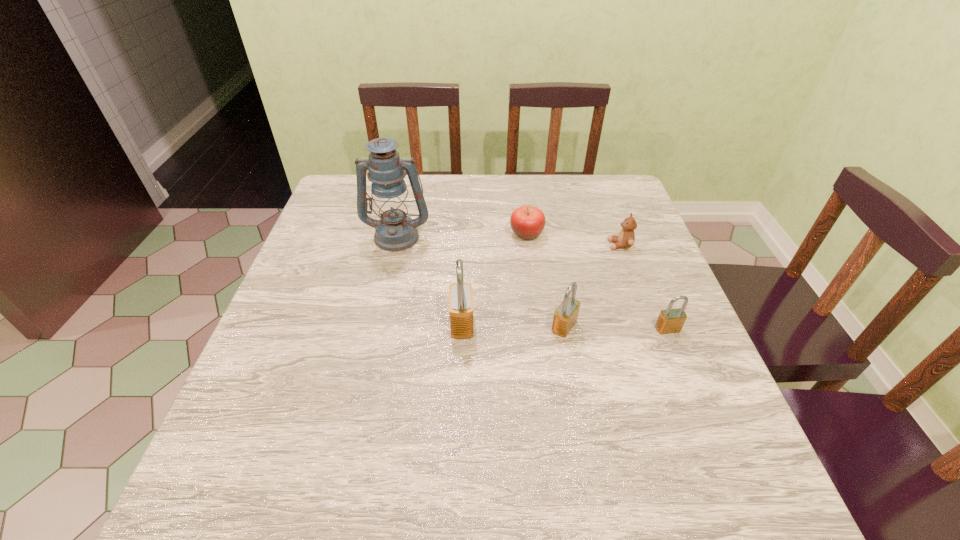
Find the location of a particular element. The height and width of the screenshot is (540, 960). the leftmost padlock is located at coordinates (460, 294).

Where is `the second tallest object`? the second tallest object is located at coordinates (460, 294).

The width and height of the screenshot is (960, 540). I want to click on the second padlock from left to right, so click(x=565, y=316).

Where is `the fourth shortest object`? The height and width of the screenshot is (540, 960). the fourth shortest object is located at coordinates (565, 316).

I want to click on the shortest padlock, so click(671, 320).

At what (x,y) coordinates should I click in order to perform the action: click on teddy bear. Please return your answer as a coordinate pair (x, y). This screenshot has height=540, width=960. Looking at the image, I should click on (626, 237).

Where is `the leftmost object`? the leftmost object is located at coordinates (395, 231).

Identify the location of lantern. The image size is (960, 540). (395, 231).

Locate an element on the screen. The height and width of the screenshot is (540, 960). apple is located at coordinates (527, 222).

This screenshot has width=960, height=540. I want to click on free location located on the left of the tallest padlock, so click(344, 324).